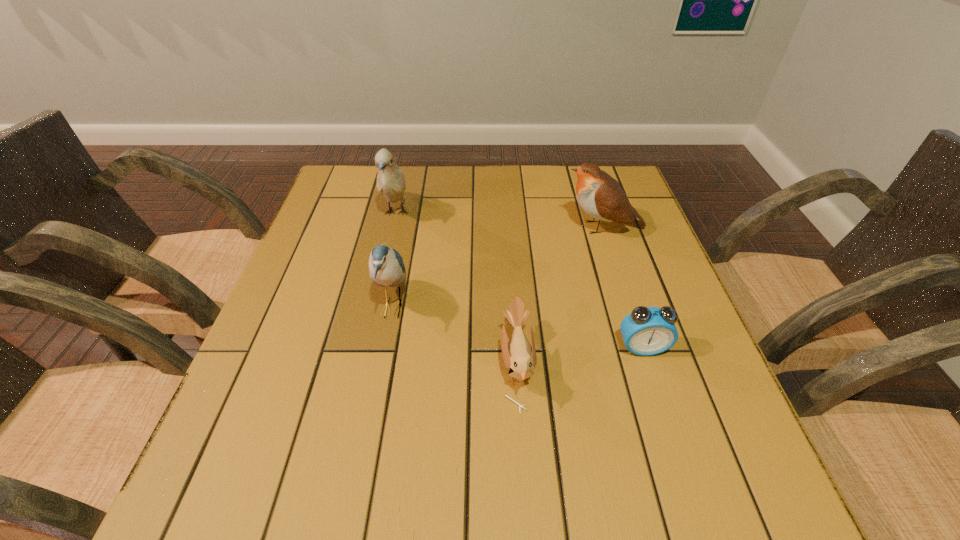
This screenshot has width=960, height=540. Identify the location of free space located at the beak of the shortest bird. (362, 364).

At what (x,y) coordinates should I click in order to perform the action: click on object that is at the far edge. Please return your answer as a coordinate pair (x, y). The height and width of the screenshot is (540, 960). Looking at the image, I should click on (390, 180).

Find the location of `bird that is at the right edge`. bird that is at the right edge is located at coordinates (602, 197).

Identify the location of alarm clock located in the right edge section of the desktop. The width and height of the screenshot is (960, 540). (646, 331).

The height and width of the screenshot is (540, 960). In the image, there is a desktop. Find the location of `vacant space at the far edge`. vacant space at the far edge is located at coordinates (536, 176).

You are a GUI agent. You are given a task and a screenshot of the screen. Output one action in this format:
    pyautogui.click(x=<x>, y=<y>)
    Task: Click on the vacant space at the near edge of the desktop
    The image size is (960, 540).
    Given the screenshot: What is the action you would take?
    pyautogui.click(x=463, y=507)

You are a GUI agent. You are given a task and a screenshot of the screen. Output one action in this format:
    pyautogui.click(x=<x>, y=<y>)
    Task: Click on the vacant space at the left edge of the desktop
    
    Given the screenshot: What is the action you would take?
    pyautogui.click(x=256, y=456)

At what (x,y) coordinates should I click in order to perform the action: click on vacant area at the right edge of the desktop. Please return your answer as a coordinate pair (x, y). Looking at the image, I should click on (612, 230).

This screenshot has width=960, height=540. In the image, there is a desktop. In order to click on free space at the far right corner in this screenshot , I will do `click(613, 167)`.

Locate an element on the screen. vacant region between the rightmost bird and the second bird from right to left is located at coordinates (560, 296).